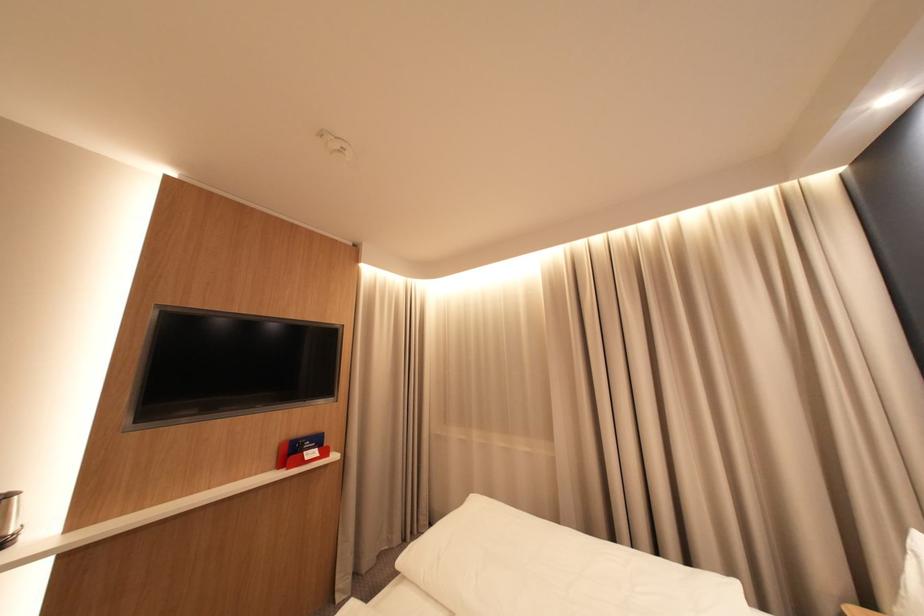
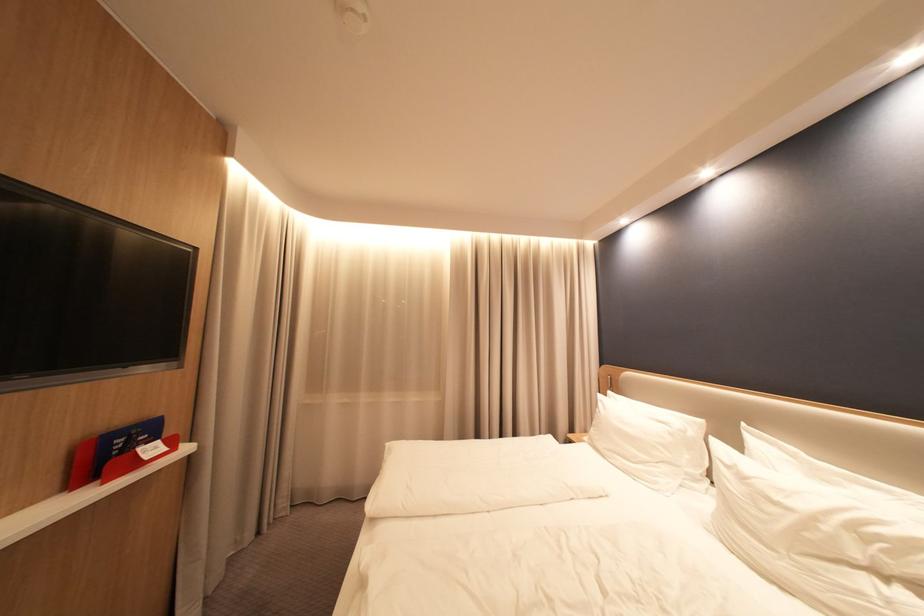
Where in the second image is the point corresponding to pixel 344 458 from the first image?

(197, 450)